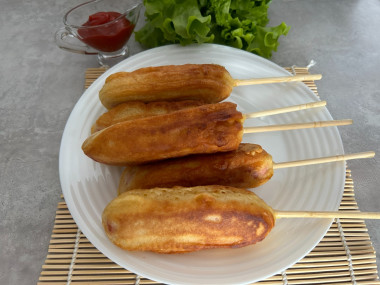
Where is `bamboo mat`? bamboo mat is located at coordinates (65, 266).